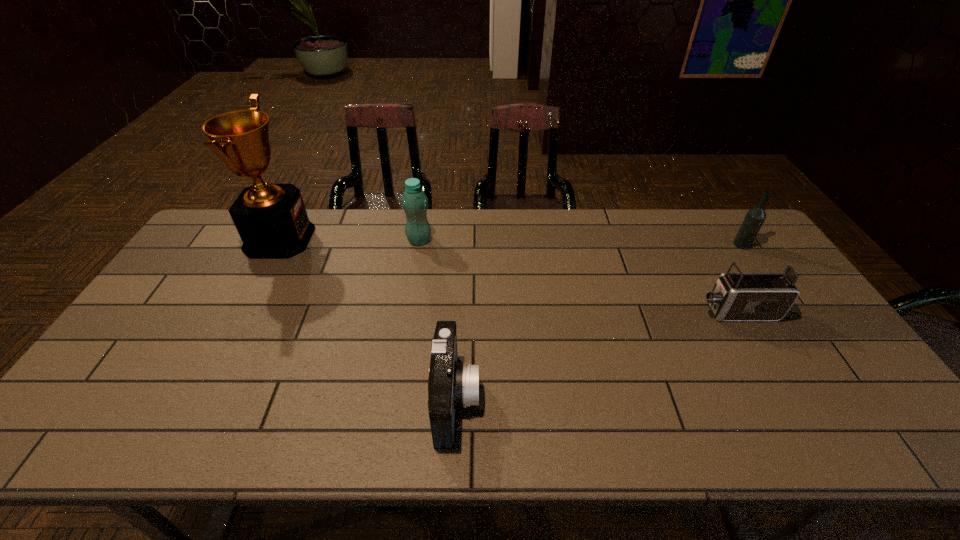
Locate an element on the screen. The height and width of the screenshot is (540, 960). vodka present at the right edge is located at coordinates (755, 217).

Locate an element on the screen. The image size is (960, 540). camcorder that is at the right edge is located at coordinates [739, 296].

Image resolution: width=960 pixels, height=540 pixels. What are the coordinates of `object that is at the far left corner` in the screenshot? It's located at (271, 219).

I want to click on object that is at the far right corner, so click(755, 217).

The image size is (960, 540). I want to click on vacant point at the far edge, so click(x=516, y=211).

Find the location of a particular element. The width and height of the screenshot is (960, 540). free spot at the near edge of the desktop is located at coordinates (683, 430).

In the image, there is a desktop. What are the coordinates of `free space at the left edge` in the screenshot? It's located at (178, 269).

This screenshot has width=960, height=540. Identify the location of blank space at the right edge of the desktop. (769, 272).

I want to click on vacant region at the far left corner of the desktop, so click(205, 251).

You are a GUI agent. You are given a task and a screenshot of the screen. Output one action in this format:
    pyautogui.click(x=<x>, y=<y>)
    Task: Click on the empty location between the leftmost object and the third object from left to right
    
    Given the screenshot: What is the action you would take?
    pyautogui.click(x=368, y=319)